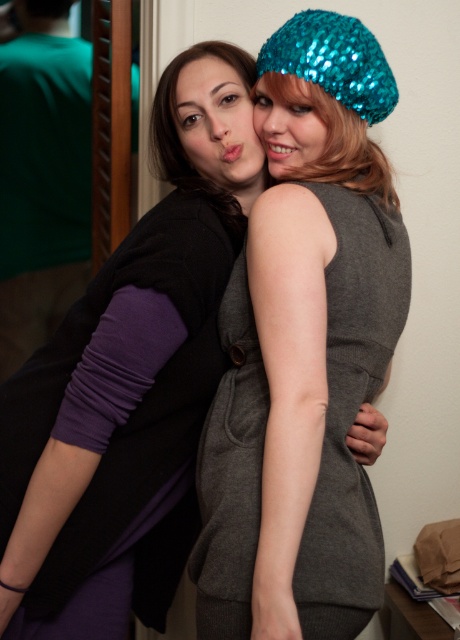
Question: Is the position of purple matte sweater at left less distant than that of gray woolen dress at center?

Choices:
 (A) yes
 (B) no

Answer: (B)

Question: Can you confirm if teal sequined beanie at upper right is positioned to the right of shiny teal sequined hat at upper right?

Choices:
 (A) no
 (B) yes

Answer: (B)

Question: Which point is closer to the camera?

Choices:
 (A) purple fabric at left
 (B) purple matte sweater at left
 (C) teal sequined beanie at upper right

Answer: (B)

Question: Based on their relative distances, which object is farther from the matte black face at upper left?

Choices:
 (A) purple fabric at left
 (B) shiny teal sequined hat at upper right
 (C) gray woolen dress at center
 (D) teal sequined beanie at upper right

Answer: (A)

Question: Is purple fabric at left to the right of matte black face at upper left from the viewer's perspective?

Choices:
 (A) yes
 (B) no

Answer: (B)

Question: Which of these objects is positioned farthest from the shiny teal sequined hat at upper right?

Choices:
 (A) purple matte sweater at left
 (B) purple fabric at left

Answer: (B)